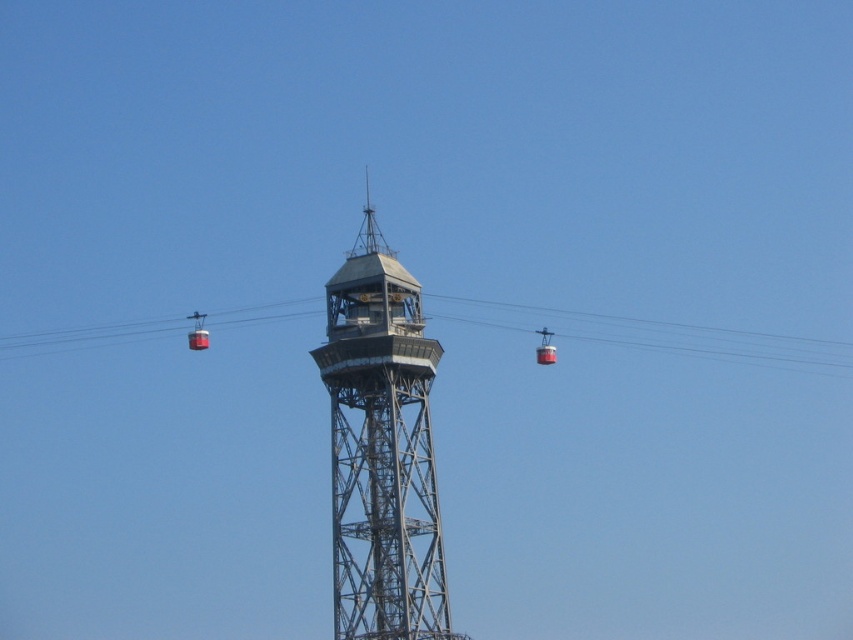
Question: Which is farther from the metallic cable car at center?

Choices:
 (A) metallic gray tower at center
 (B) metallic red cable car at right

Answer: (A)

Question: Can you confirm if metallic cable car at center is thinner than metallic red cable car at right?

Choices:
 (A) no
 (B) yes

Answer: (A)

Question: Can you confirm if metallic gray tower at center is smaller than metallic cable car at center?

Choices:
 (A) yes
 (B) no

Answer: (B)

Question: Among these objects, which one is farthest from the camera?

Choices:
 (A) metallic cable car at center
 (B) metallic gray tower at center
 (C) metallic red cable car at right

Answer: (A)

Question: Considering the relative positions of metallic gray tower at center and metallic red cable car at right in the image provided, where is metallic gray tower at center located with respect to metallic red cable car at right?

Choices:
 (A) below
 (B) above

Answer: (A)

Question: Which object appears farthest from the camera in this image?

Choices:
 (A) metallic gray tower at center
 (B) metallic red cable car at right
 (C) metallic cable car at center

Answer: (C)